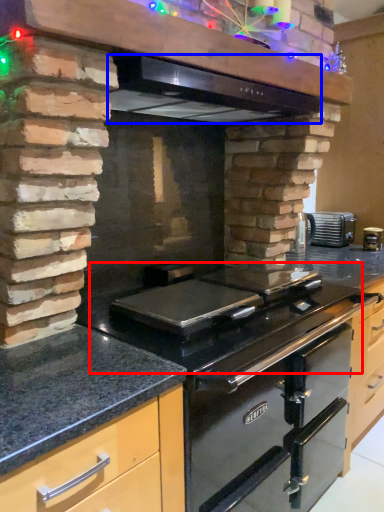
Question: Which point is closer to the camera, gas stove (highlighted by a red box) or exhaust hood (highlighted by a blue box)?

Choices:
 (A) gas stove
 (B) exhaust hood

Answer: (A)